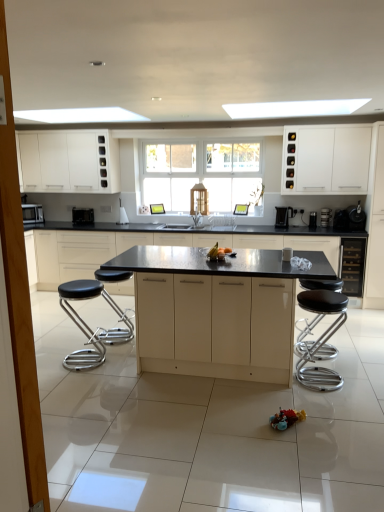
Question: Relative to white matte cabinet at upper right, the fourth cabinetry from the back, is black plastic coffee maker at center right, marked as the third appliance in a right-to-left arrangement, in front or behind?

Choices:
 (A) front
 (B) behind

Answer: (B)

Question: From a real-world perspective, is black plastic coffee maker at center right, which is the 3th appliance in left-to-right order, positioned above or below white matte cabinet at upper right, acting as the third cabinetry starting from the front?

Choices:
 (A) above
 (B) below

Answer: (B)

Question: Considering the real-world distances, which object is closest to the matte black microwave at left, the fifth appliance from the right?

Choices:
 (A) matte black countertop at center, the fourth cabinetry positioned from the front
 (B) black glass wine cooler at right, arranged as the second appliance when viewed from the right
 (C) black plastic coffee machine at center, arranged as the 2th coffee machine when viewed from the right
 (D) wooden screen door at left
 (E) black chrome bar stool at right, arranged as the first bar stool when viewed from the right

Answer: (A)

Question: Estimate the real-world distances between objects in this image. Which object is farther from the white matte cabinet at upper right, the fourth cabinetry from the back?

Choices:
 (A) black plastic coffee maker at center right, which is the 3th appliance in left-to-right order
 (B) black glass wine cooler at right, arranged as the second appliance when viewed from the right
 (C) black leather stool at left, acting as the 2th bar stool starting from the right
 (D) white matte cabinet at upper left, which appears as the 1th cabinetry when viewed from the back
 (E) matte black countertop at center, arranged as the first cabinetry when viewed from the front

Answer: (C)